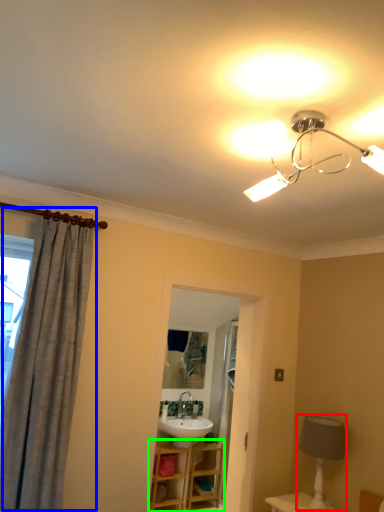
Question: Considering the real-world distances, which object is farthest from table lamp (highlighted by a red box)? curtain (highlighted by a blue box) or vanity (highlighted by a green box)?

Choices:
 (A) curtain
 (B) vanity

Answer: (B)